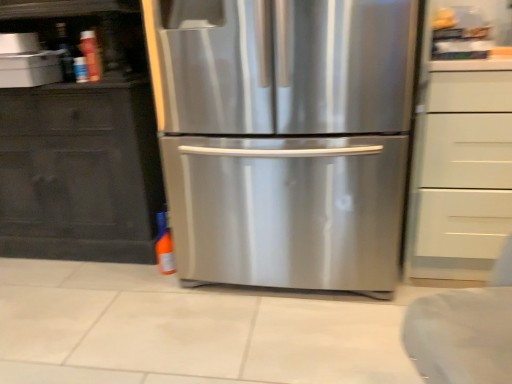
Measure the distance between point (367, 65) and camera.

Point (367, 65) and camera are 1.40 meters apart from each other.

Find the location of a particular element. The height and width of the screenshot is (384, 512). stainless steel refrigerator at center is located at coordinates (284, 138).

The image size is (512, 384). What do you see at coordinates (284, 138) in the screenshot?
I see `stainless steel refrigerator at center` at bounding box center [284, 138].

Where is `stainless steel refrigerator at center`? The width and height of the screenshot is (512, 384). stainless steel refrigerator at center is located at coordinates (284, 138).